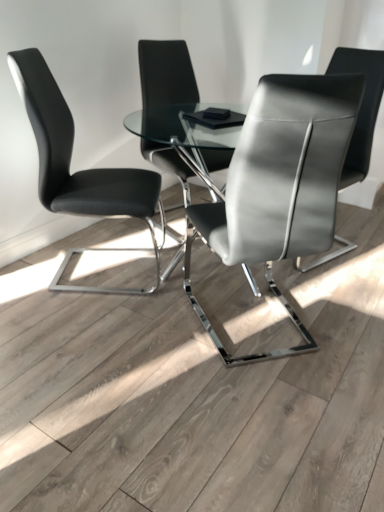
I want to click on free spot in front of black leather chair at left, which appears as the fourth chair when viewed from the right, so click(91, 322).